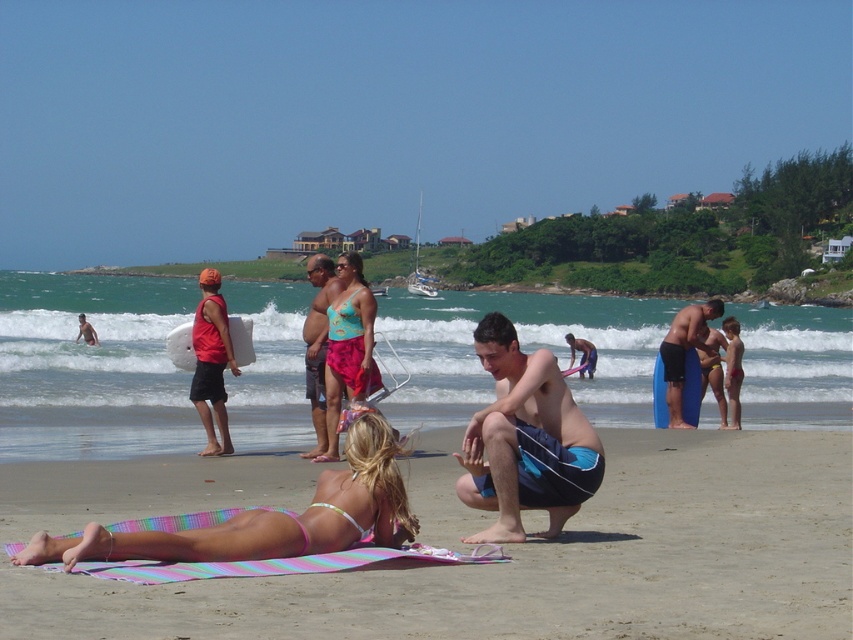
Question: Which is farther from the pink striped towel at lower center?

Choices:
 (A) matte red tank top at center
 (B) matte black surfboard at center
 (C) matte teal bikini top at center

Answer: (B)

Question: Does matte red tank top at center appear over matte blue surfboard at center?

Choices:
 (A) no
 (B) yes

Answer: (B)

Question: Is the position of pink striped towel at lower center more distant than that of turquoise fabric bikini top at center?

Choices:
 (A) yes
 (B) no

Answer: (B)

Question: Based on their relative distances, which object is nearer to the matte black surfboard at center?

Choices:
 (A) blue shorts at center
 (B) pink fabric bikini at lower left
 (C) matte teal bikini top at center
 (D) matte red tank top at center

Answer: (D)

Question: Among these objects, which one is farthest from the camera?

Choices:
 (A) pink striped towel at lower center
 (B) pink fabric bikini at lower left
 (C) matte red tank top at center
 (D) matte black surfboard at center

Answer: (D)

Question: Can you confirm if blue shorts at center is thinner than matte blue surfboard at center?

Choices:
 (A) no
 (B) yes

Answer: (A)